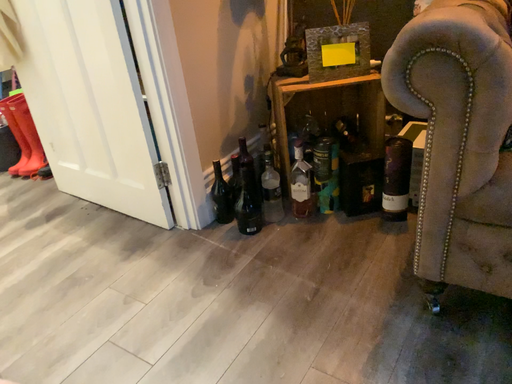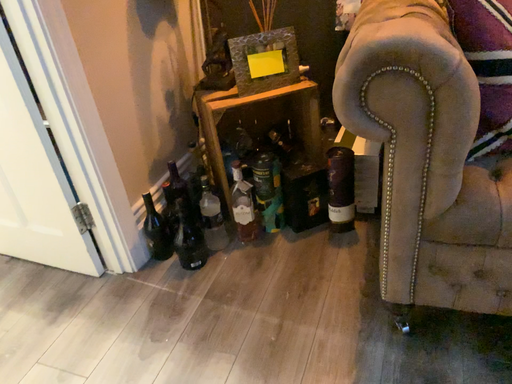
Question: Which way did the camera rotate in the video?

Choices:
 (A) rotated right
 (B) rotated left

Answer: (A)